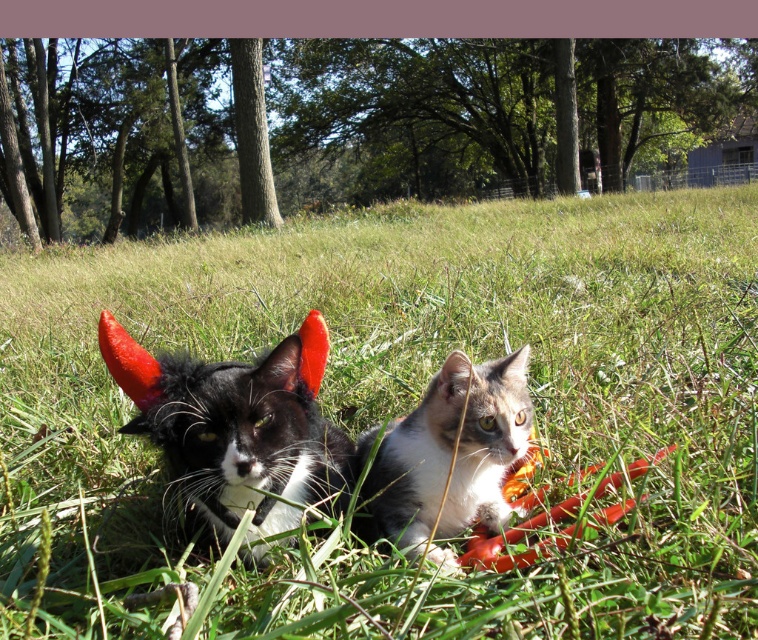
Which of these two, green grass at center or black matte fur cat at center, stands taller?

With more height is green grass at center.

Between point (298, 593) and point (208, 515), which one is positioned behind?

Positioned behind is point (208, 515).

Where is `green grass at center`? green grass at center is located at coordinates (415, 396).

Who is positioned more to the left, black matte fur cat at center or tabby fur cat at center?

black matte fur cat at center is more to the left.

How distant is black matte fur cat at center from tabby fur cat at center?

The distance of black matte fur cat at center from tabby fur cat at center is 9.77 inches.

What are the coordinates of `black matte fur cat at center` in the screenshot? It's located at (236, 433).

Does tabby fur cat at center have a larger size compared to rubber chew toy at lower center?

Indeed, tabby fur cat at center has a larger size compared to rubber chew toy at lower center.

Which is below, tabby fur cat at center or rubber chew toy at lower center?

rubber chew toy at lower center

Where is `tabby fur cat at center`? tabby fur cat at center is located at coordinates (450, 452).